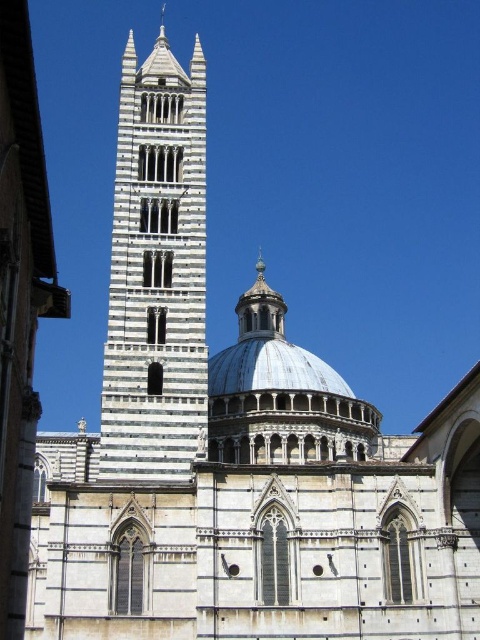
Question: Can you confirm if white marble tower at center is wider than metallic silver dome at center?

Choices:
 (A) yes
 (B) no

Answer: (A)

Question: Is white marble tower at center in front of metallic silver dome at center?

Choices:
 (A) yes
 (B) no

Answer: (A)

Question: Can you confirm if white marble tower at center is positioned to the right of metallic silver dome at center?

Choices:
 (A) yes
 (B) no

Answer: (B)

Question: Which object appears closest to the camera in this image?

Choices:
 (A) metallic silver dome at center
 (B) white marble tower at center

Answer: (B)

Question: Which object is closer to the camera taking this photo?

Choices:
 (A) white marble tower at center
 (B) metallic silver dome at center

Answer: (A)